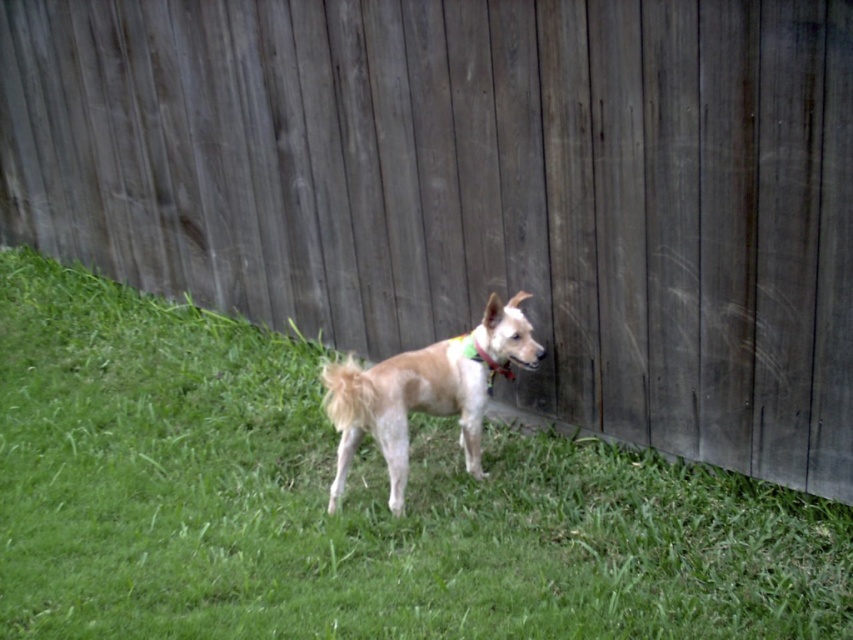
You are standing at the point marked as point (347, 502). What is the color of the ground beneath your feet?

The ground beneath your feet at point (347, 502) is green grass at center.

You are standing at the origin point in the image. You see a fuzzy tan dog at center represented by point (403, 406). What direction should you move to reach the fuzzy tan dog at center?

The fuzzy tan dog at center is located at point (403, 406), so you should move towards that coordinate to reach it.

You are a photographer setting up a camera to take a portrait of the fuzzy tan dog at center. You notice the multicolored fabric neckband at center in the frame. Will the neckband be entirely visible if you focus on the dog? Please explain.

The fuzzy tan dog at center might be wider than multicolored fabric neckband at center. Since the dog is wider, focusing on it may cause the neckband to be partially obscured or out of frame. Adjust the camera angle or zoom to ensure the neckband is fully visible.